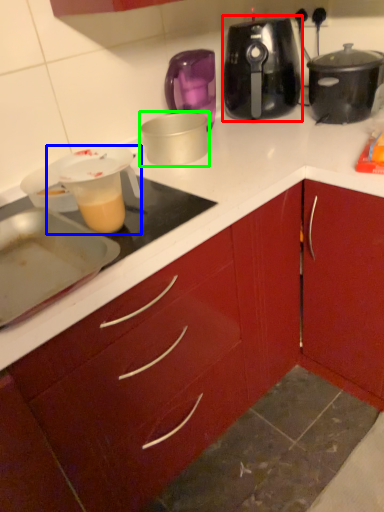
Question: Which is nearer to the slow cooker (highlighted by a red box)? kitchen appliance (highlighted by a blue box) or kitchen appliance (highlighted by a green box).

Choices:
 (A) kitchen appliance
 (B) kitchen appliance

Answer: (B)